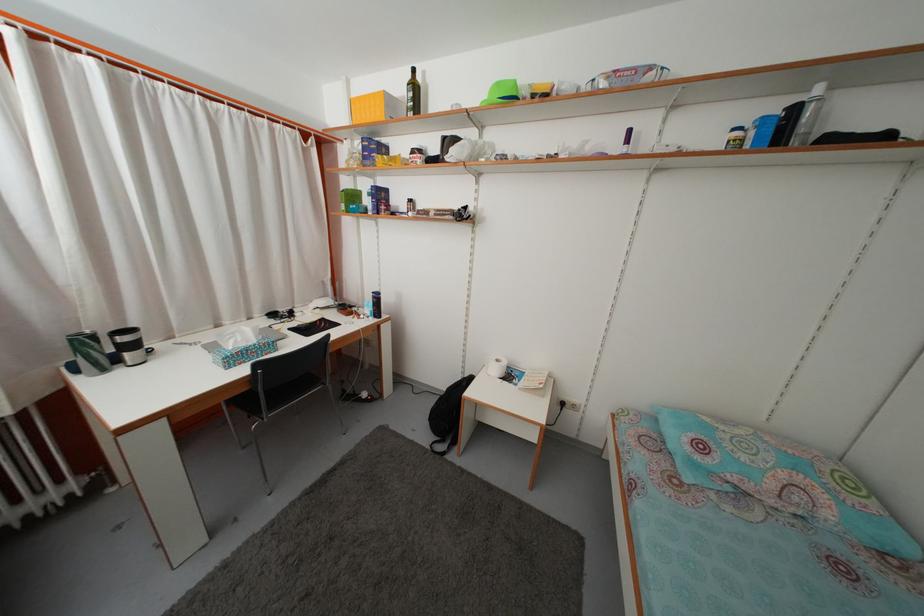
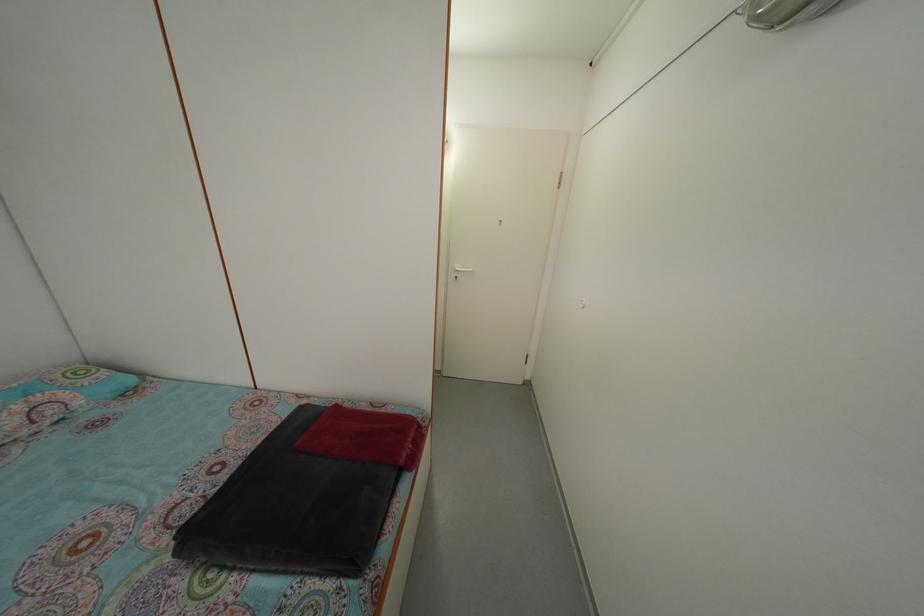
How did the camera likely rotate?

The camera rotated toward right-down.